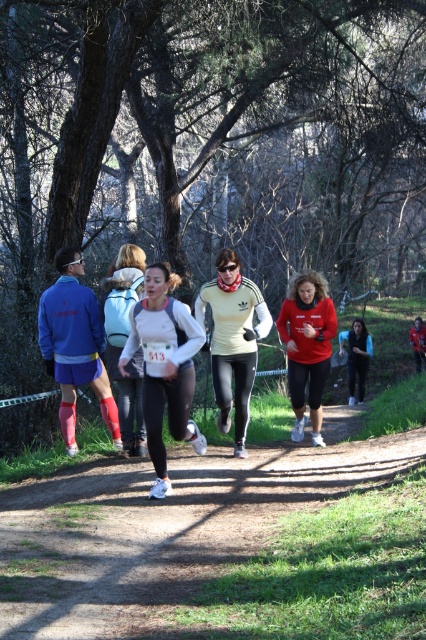
You are a photographer positioned at the starting line of the trail run. You want to capture a photo of the white matte running shoes at center and the black matte leggings at center in the same frame. Given that your camera has a maximum focus range of 10 meters, will both subjects be in focus?

The white matte running shoes at center is 11.04 meters from the black matte leggings at center. Since the maximum focus range is 10 meters, the distance between them exceeds this limit, so both subjects cannot be in focus simultaneously.

You are a photographer positioned at the starting line of the trail run. You want to capture a photo of the white matte running shoes at center and the black matte leggings at center. Based on their positions, which one will appear closer to the camera in the photo?

The white matte running shoes at center will appear closer to the camera in the photo because they are positioned in front of the black matte leggings at center.

You are a race organizer and need to ensure that the race bib numbers are visible to the camera positioned at the finish line. The camera can only clearly capture bib numbers on tops with a minimum size of 10 square inches. Given that the matte yellow top at center has a larger size compared to the red matte running top at center, which runner should you check first to confirm their bib number visibility?

The matte yellow top at center has a larger size compared to the red matte running top at center, so you should check the red matte running top at center first since it is smaller and might have a harder time meeting the minimum size requirement for bib number visibility.